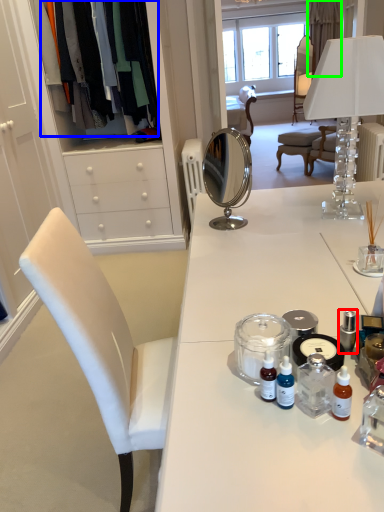
Question: Considering the real-world distances, which object is farthest from toiletry (highlighted by a red box)? clothing (highlighted by a blue box) or curtain (highlighted by a green box)?

Choices:
 (A) clothing
 (B) curtain

Answer: (B)